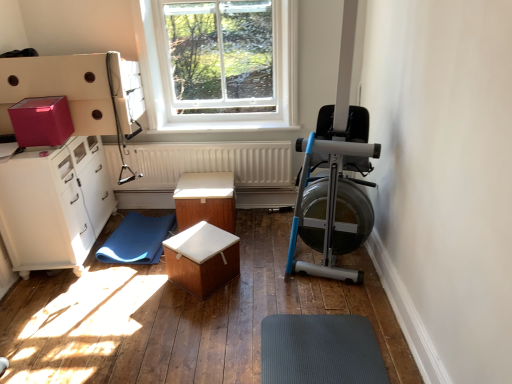
Describe the element at coordinates (136, 240) in the screenshot. The height and width of the screenshot is (384, 512). I see `blue rubber mat at lower left` at that location.

Locate an element on the screen. This screenshot has width=512, height=384. wooden box at center, the first table in the front-to-back sequence is located at coordinates (202, 258).

The width and height of the screenshot is (512, 384). I want to click on matte pink cardboard box at upper left, so click(x=41, y=121).

Where is `clear glass window at upper center`? The image size is (512, 384). clear glass window at upper center is located at coordinates (220, 63).

From the picture: Is blue rubber mat at lower left located outside white glossy cabinet at left?

Yes.

Measure the distance from blue rubber mat at lower left to white glossy cabinet at left.

A distance of 18.15 inches exists between blue rubber mat at lower left and white glossy cabinet at left.

Is point (143, 251) closer or farther from the camera than point (60, 221)?

Point (143, 251) is positioned farther from the camera compared to point (60, 221).

Is blue rubber mat at lower left behind white glossy cabinet at left?

Yes, it is.

Are blue rubber mat at lower left and clear glass window at upper center located far from each other?

That's right, there is a large distance between blue rubber mat at lower left and clear glass window at upper center.

In terms of width, does blue rubber mat at lower left look wider or thinner when compared to clear glass window at upper center?

Considering their sizes, blue rubber mat at lower left looks broader than clear glass window at upper center.

Based on their sizes in the image, would you say blue rubber mat at lower left is bigger or smaller than clear glass window at upper center?

Considering their sizes, blue rubber mat at lower left takes up less space than clear glass window at upper center.

Is point (159, 239) positioned behind point (154, 2)?

Yes, point (159, 239) is behind point (154, 2).

From the image's perspective, which one is positioned higher, wooden box at center, the first table in the front-to-back sequence, or blue rubber mat at lower left?

blue rubber mat at lower left is shown above in the image.

Is wooden box at center, arranged as the second table when viewed from the back, spatially inside blue rubber mat at lower left, or outside of it?

wooden box at center, arranged as the second table when viewed from the back, is not inside blue rubber mat at lower left, it's outside.

Could you measure the distance between wooden box at center, arranged as the second table when viewed from the back, and blue rubber mat at lower left?

A distance of 19.62 inches exists between wooden box at center, arranged as the second table when viewed from the back, and blue rubber mat at lower left.

From a real-world perspective, which object stands above the other?

wooden box at center, arranged as the second table when viewed from the back.

Between wooden box at center, the second table when ordered from front to back, and white textured radiator at center, which one has smaller width?

With smaller width is white textured radiator at center.

I want to click on the 1st table in front of the white textured radiator at center, starting your count from the anchor, so click(205, 200).

Considering the relative sizes of white textured radiator at center and matte pink cardboard box at upper left in the image provided, is white textured radiator at center bigger than matte pink cardboard box at upper left?

Correct, white textured radiator at center is larger in size than matte pink cardboard box at upper left.

From a real-world perspective, is white textured radiator at center positioned above or below matte pink cardboard box at upper left?

white textured radiator at center is situated lower than matte pink cardboard box at upper left in the real world.

Looking at their sizes, would you say white textured radiator at center is wider or thinner than matte pink cardboard box at upper left?

Clearly, white textured radiator at center has less width compared to matte pink cardboard box at upper left.

How different are the orientations of white textured radiator at center and matte pink cardboard box at upper left in degrees?

They differ by 0.859 degrees in their facing directions.

Would you consider matte pink cardboard box at upper left to be distant from wooden box at center, the first table in the front-to-back sequence?

Yes, matte pink cardboard box at upper left is far from wooden box at center, the first table in the front-to-back sequence.

Considering the relative sizes of matte pink cardboard box at upper left and wooden box at center, arranged as the second table when viewed from the back, in the image provided, is matte pink cardboard box at upper left shorter than wooden box at center, arranged as the second table when viewed from the back,?

Yes, matte pink cardboard box at upper left is shorter than wooden box at center, arranged as the second table when viewed from the back.

From the image's perspective, would you say matte pink cardboard box at upper left is shown under wooden box at center, arranged as the second table when viewed from the back?

Actually, matte pink cardboard box at upper left appears above wooden box at center, arranged as the second table when viewed from the back, in the image.

What are the coordinates of `table that is the 2nd one below the matte pink cardboard box at upper left (from a real-world perspective)` in the screenshot? It's located at (202, 258).

Are clear glass window at upper center and wooden box at center, the first table in the front-to-back sequence, making contact?

No, clear glass window at upper center is not touching wooden box at center, the first table in the front-to-back sequence.

From the image's perspective, which is below, clear glass window at upper center or wooden box at center, arranged as the second table when viewed from the back?

wooden box at center, arranged as the second table when viewed from the back, from the image's perspective.

In the image, is clear glass window at upper center positioned in front of or behind wooden box at center, the first table in the front-to-back sequence?

In the image, clear glass window at upper center appears behind wooden box at center, the first table in the front-to-back sequence.

From the image's perspective, which table is the 2nd one below the clear glass window at upper center? Please provide its 2D coordinates.

[(202, 258)]

Locate an element on the screen. The height and width of the screenshot is (384, 512). cabinetry in front of the blue rubber mat at lower left is located at coordinates (55, 205).

Identify the location of window above the blue rubber mat at lower left (from the image's perspective). This screenshot has width=512, height=384. (220, 63).

Based on their spatial positions, is matte pink cardboard box at upper left or white glossy cabinet at left further from blue rubber mat at lower left?

matte pink cardboard box at upper left.

Estimate the real-world distances between objects in this image. Which object is closer to matte pink cardboard box at upper left, wooden box at center, the first table in the front-to-back sequence, or white textured radiator at center?

white textured radiator at center lies closer to matte pink cardboard box at upper left than the other object.

When comparing their distances from white textured radiator at center, does white glossy cabinet at left or matte pink cardboard box at upper left seem closer?

white glossy cabinet at left.

Based on their spatial positions, is wooden box at center, the first table in the front-to-back sequence, or wooden box at center, the second table when ordered from front to back, closer to white glossy cabinet at left?

The object closer to white glossy cabinet at left is wooden box at center, the second table when ordered from front to back.

Considering their positions, is matte pink cardboard box at upper left positioned further to white textured radiator at center than wooden box at center, the second table when ordered from front to back?

matte pink cardboard box at upper left lies further to white textured radiator at center than the other object.

Looking at the image, which one is located closer to wooden box at center, arranged as the second table when viewed from the back, white glossy cabinet at left or wooden box at center, the second table when ordered from front to back?

wooden box at center, the second table when ordered from front to back.

Considering their positions, is wooden box at center, arranged as the second table when viewed from the back, positioned closer to white glossy cabinet at left than clear glass window at upper center?

wooden box at center, arranged as the second table when viewed from the back, is closer to white glossy cabinet at left.

Estimate the real-world distances between objects in this image. Which object is closer to matte pink cardboard box at upper left, wooden box at center, which is the first table from back to front, or wooden box at center, arranged as the second table when viewed from the back?

Based on the image, wooden box at center, which is the first table from back to front, appears to be nearer to matte pink cardboard box at upper left.

This screenshot has height=384, width=512. I want to click on cabinetry between matte pink cardboard box at upper left and blue rubber mat at lower left vertically, so click(55, 205).

You are a GUI agent. You are given a task and a screenshot of the screen. Output one action in this format:
    pyautogui.click(x=<x>, y=<y>)
    Task: Click on the radiator between white glossy cabinet at left and clear glass window at upper center in the horizontal direction
    
    Given the screenshot: What is the action you would take?
    pyautogui.click(x=204, y=163)

Identify the location of cardboard box between white glossy cabinet at left and clear glass window at upper center from left to right. Image resolution: width=512 pixels, height=384 pixels. (41, 121).

At what (x,y) coordinates should I click in order to perform the action: click on table between white glossy cabinet at left and wooden box at center, the first table in the front-to-back sequence, in the horizontal direction. Please return your answer as a coordinate pair (x, y). Looking at the image, I should click on (205, 200).